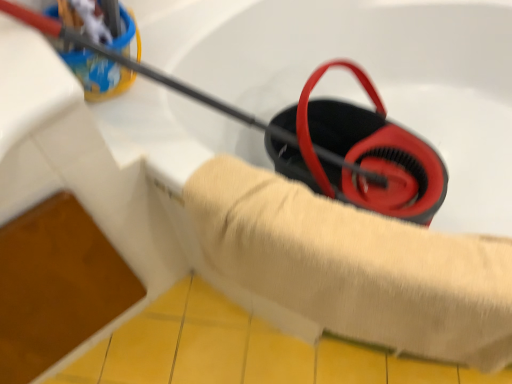
Question: Should I look upward or downward to see beige cotton towel at center?

Choices:
 (A) up
 (B) down

Answer: (B)